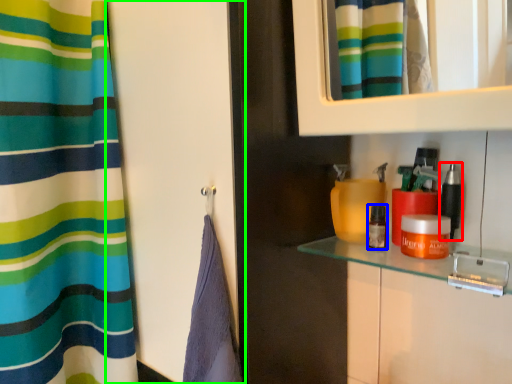
Question: Considering the real-world distances, which object is farthest from cosmetic (highlighted by a red box)? cosmetic (highlighted by a blue box) or screen door (highlighted by a green box)?

Choices:
 (A) cosmetic
 (B) screen door

Answer: (B)